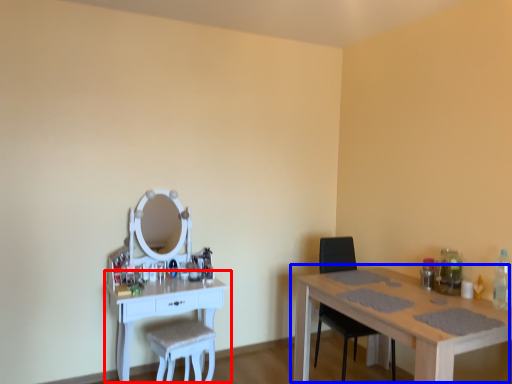
Question: Which point is closer to the camera, table (highlighted by a red box) or table (highlighted by a blue box)?

Choices:
 (A) table
 (B) table

Answer: (B)